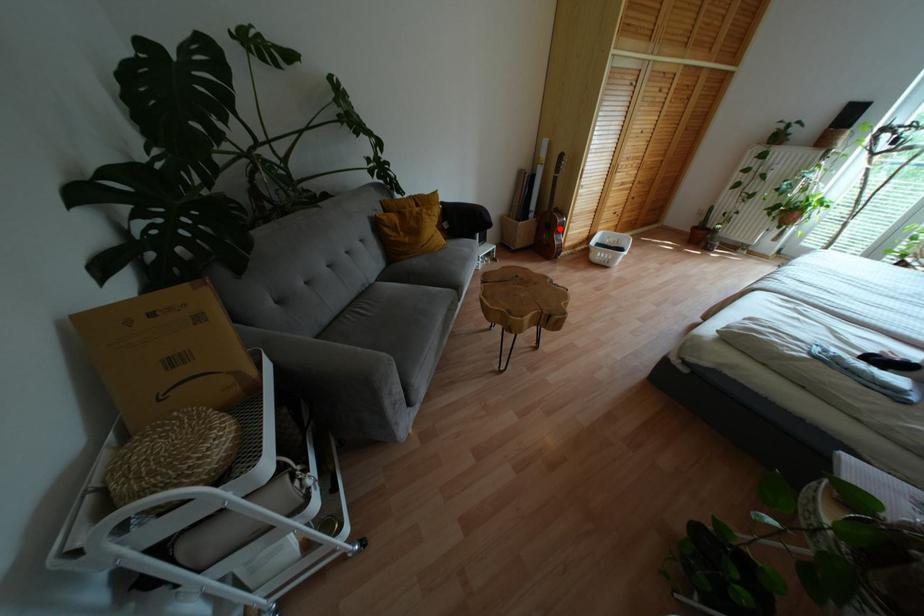
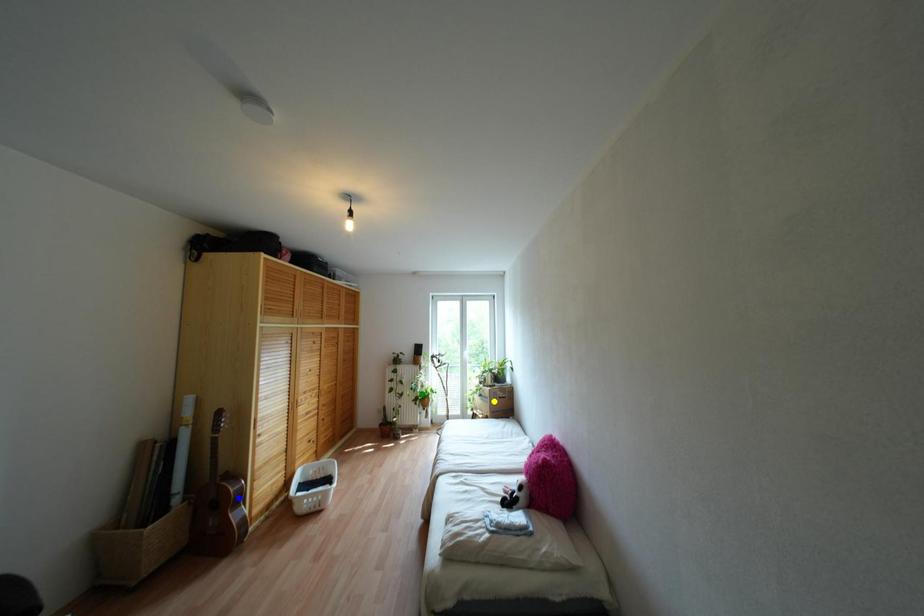
Question: I am providing you with two images of the same scene from different viewpoints. A red point is marked on the first image. You are given multiple points on the second image. Which point in image 2 represents the same 3d spot as the red point in image 1?

Choices:
 (A) blue point
 (B) green point
 (C) yellow point

Answer: (A)